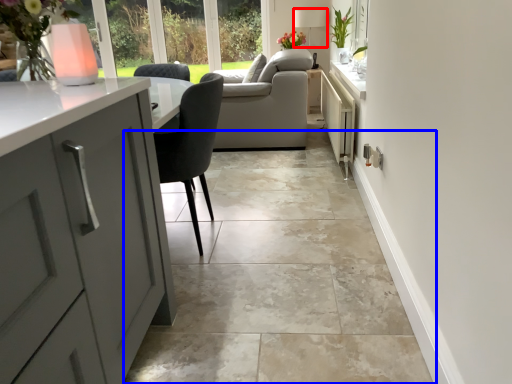
Question: Which of the following is the farthest to the observer, lamp (highlighted by a red box) or ceramic tile (highlighted by a blue box)?

Choices:
 (A) lamp
 (B) ceramic tile

Answer: (A)